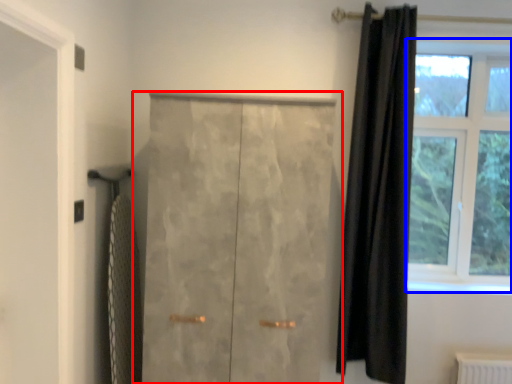
Question: Which of the following is the farthest to the observer, door (highlighted by a red box) or window (highlighted by a blue box)?

Choices:
 (A) door
 (B) window

Answer: (B)